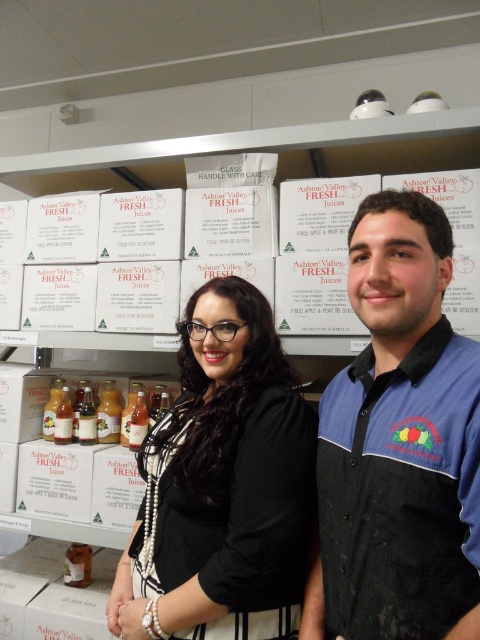
Is point (349, 596) behind point (300, 532)?

No, it is not.

Which is more to the right, blue fabric shirt at center or black matte blouse at center?

blue fabric shirt at center

Does point (332, 486) come farther from viewer compared to point (208, 566)?

No.

The height and width of the screenshot is (640, 480). Identify the location of blue fabric shirt at center. (398, 444).